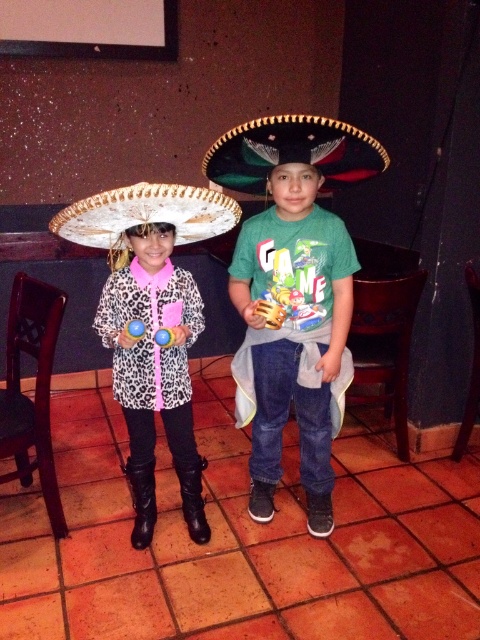
Who is more distant from viewer, (228,164) or (164,365)?

The point (164,365) is more distant.

Does leopard print jacket at center lie in front of leopard print coat at center?

Yes, leopard print jacket at center is closer to the viewer.

Measure the distance between leopard print jacket at center and camera.

1.45 meters

Where is `leopard print jacket at center`? leopard print jacket at center is located at coordinates (292, 292).

Who is shorter, green matte shirt at center or white felt sombrero at left?

Standing shorter between the two is white felt sombrero at left.

Measure the distance between point (262, 214) and camera.

Point (262, 214) and camera are 6.35 feet apart from each other.

Does point (255, 449) lie behind point (103, 204)?

That is True.

This screenshot has height=640, width=480. Find the location of `green matte shirt at center`. green matte shirt at center is located at coordinates click(x=291, y=308).

Is green matte shirt at center closer to camera compared to leopard print coat at center?

Yes, green matte shirt at center is in front of leopard print coat at center.

Is green matte shirt at center bigger than leopard print coat at center?

Incorrect, green matte shirt at center is not larger than leopard print coat at center.

At what (x,y) coordinates should I click in order to perform the action: click on green matte shirt at center. Please return your answer as a coordinate pair (x, y). Looking at the image, I should click on (291, 308).